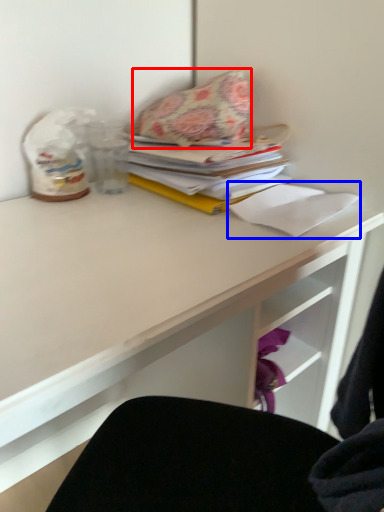
Question: Which object appears farthest to the camera in this image, throw pillow (highlighted by a red box) or paper (highlighted by a blue box)?

Choices:
 (A) throw pillow
 (B) paper

Answer: (A)